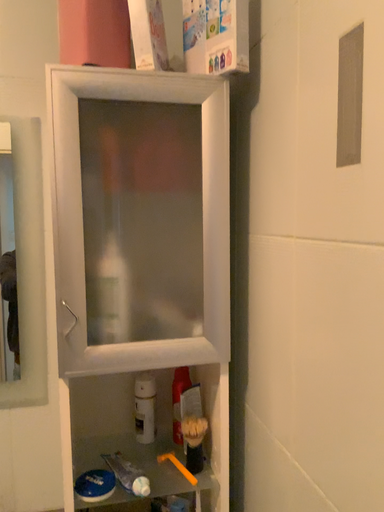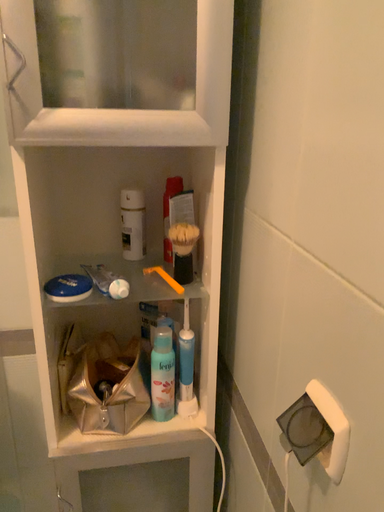
Question: Which way did the camera rotate in the video?

Choices:
 (A) rotated downward
 (B) rotated upward

Answer: (A)